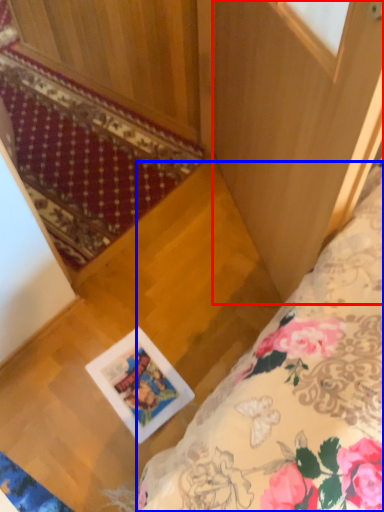
Question: Which of the following is the farthest to the observer, screen door (highlighted by a red box) or bed (highlighted by a blue box)?

Choices:
 (A) screen door
 (B) bed

Answer: (B)